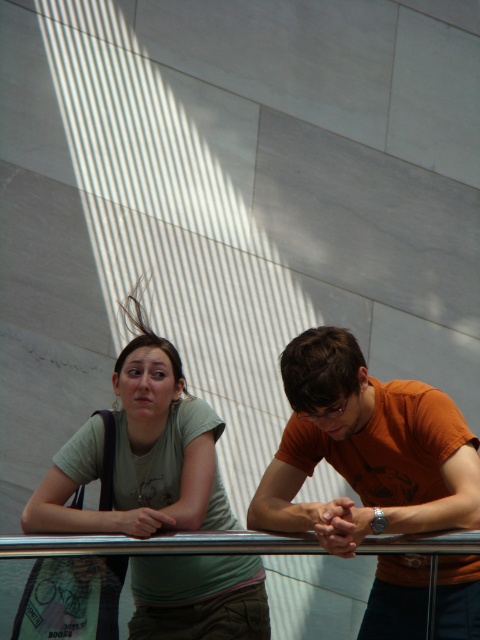
Describe the element at coordinates (365, 449) in the screenshot. I see `orange cotton shirt at center` at that location.

Which of these two, orange cotton shirt at center or matte green t-shirt at center, stands taller?

matte green t-shirt at center is taller.

Measure the distance between orange cotton shirt at center and camera.

The distance of orange cotton shirt at center from camera is 77.49 feet.

Identify the location of orange cotton shirt at center. (365, 449).